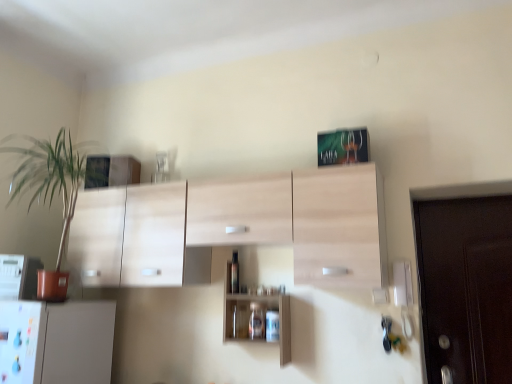
Question: Would you say white plastic microwave at left is part of wooden cabinet at center's contents?

Choices:
 (A) yes
 (B) no

Answer: (B)

Question: From the image's perspective, is wooden cabinet at center above white plastic microwave at left?

Choices:
 (A) yes
 (B) no

Answer: (B)

Question: From a real-world perspective, is wooden cabinet at center physically below white plastic microwave at left?

Choices:
 (A) no
 (B) yes

Answer: (B)

Question: Is wooden cabinet at center not within white plastic microwave at left?

Choices:
 (A) yes
 (B) no

Answer: (A)

Question: Is wooden cabinet at center positioned far away from white plastic microwave at left?

Choices:
 (A) no
 (B) yes

Answer: (B)

Question: Is transparent glass bottle at center spatially inside green leafy plant at left, or outside of it?

Choices:
 (A) inside
 (B) outside

Answer: (B)

Question: Does point (236, 284) appear closer or farther from the camera than point (72, 195)?

Choices:
 (A) farther
 (B) closer

Answer: (B)

Question: Considering the positions of transparent glass bottle at center and green leafy plant at left in the image, is transparent glass bottle at center wider or thinner than green leafy plant at left?

Choices:
 (A) thin
 (B) wide

Answer: (A)

Question: Considering their positions, is transparent glass bottle at center located in front of or behind green leafy plant at left?

Choices:
 (A) front
 (B) behind

Answer: (B)

Question: From their relative heights in the image, would you say wooden cabinet at center is taller or shorter than transparent glass bottle at center?

Choices:
 (A) short
 (B) tall

Answer: (B)

Question: Based on their sizes in the image, would you say wooden cabinet at center is bigger or smaller than transparent glass bottle at center?

Choices:
 (A) big
 (B) small

Answer: (A)

Question: Does point (280, 307) appear closer or farther from the camera than point (237, 258)?

Choices:
 (A) farther
 (B) closer

Answer: (B)

Question: From a real-world perspective, relative to transparent glass bottle at center, is wooden cabinet at center vertically above or below?

Choices:
 (A) above
 (B) below

Answer: (B)

Question: From the image's perspective, is wooden cabinet at center located above or below white plastic microwave at left?

Choices:
 (A) below
 (B) above

Answer: (A)

Question: In the image, is wooden cabinet at center positioned in front of or behind white plastic microwave at left?

Choices:
 (A) behind
 (B) front

Answer: (B)